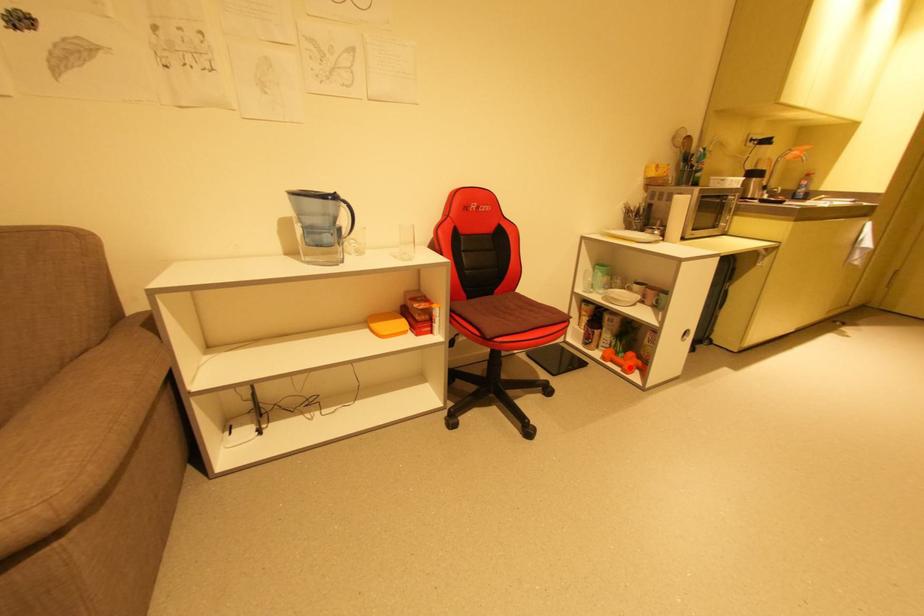
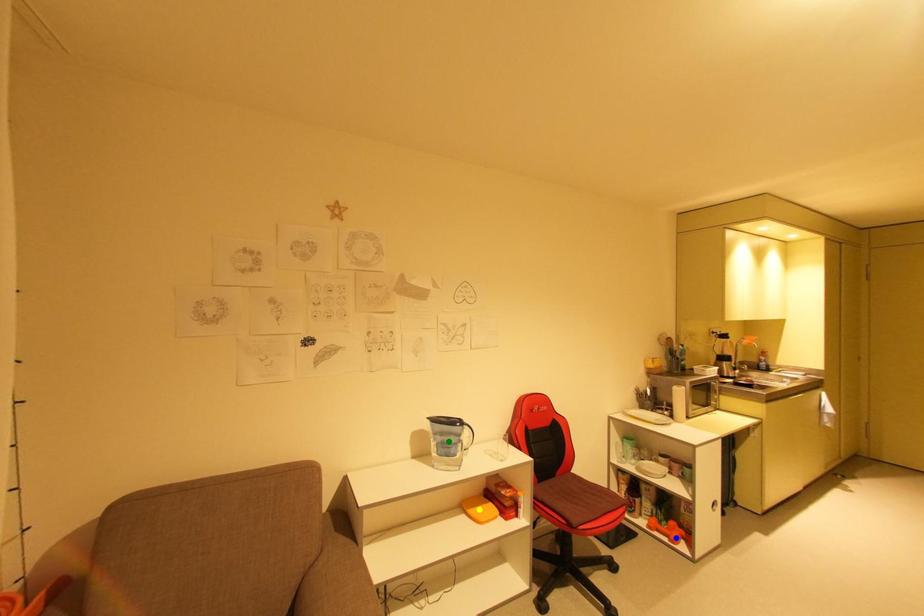
Question: I am providing you with two images of the same scene from different viewpoints. A red point is marked on the first image. You are given multiple points on the second image. In image 2, which mark is for the same physical point as the one in image 1?

Choices:
 (A) yellow point
 (B) green point
 (C) blue point

Answer: (C)